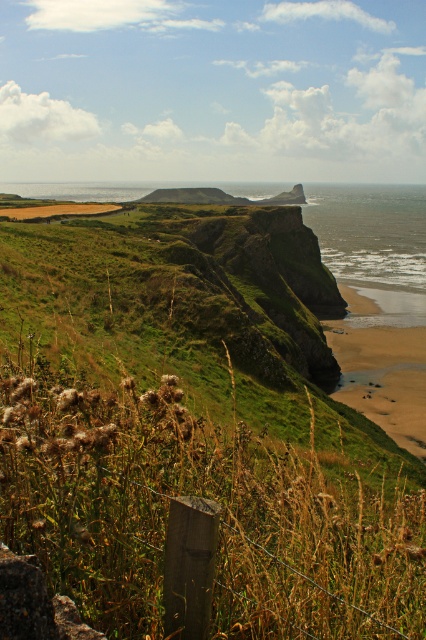
Can you confirm if green grassy at center is thinner than sandy beach at lower right?

No, green grassy at center is not thinner than sandy beach at lower right.

Image resolution: width=426 pixels, height=640 pixels. What are the coordinates of `green grassy at center` in the screenshot? It's located at (198, 426).